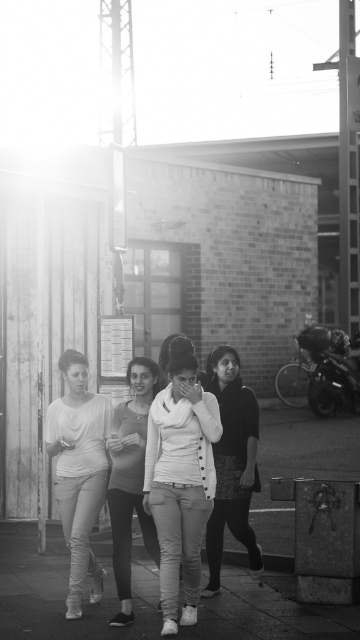
You are a fashion designer observing the two white sweaters in the image. Which one is taller, the white cotton sweater at center or the white textured sweater at center?

The white cotton sweater at center is taller than the white textured sweater at center according to the description.

You are a photographer standing at the train station. You see two white items in the scene, the matte white blouse at center and the matte white sweater at center. Which one is closer to you?

The matte white blouse at center is closer to you because it is further to the viewer than the matte white sweater at center.